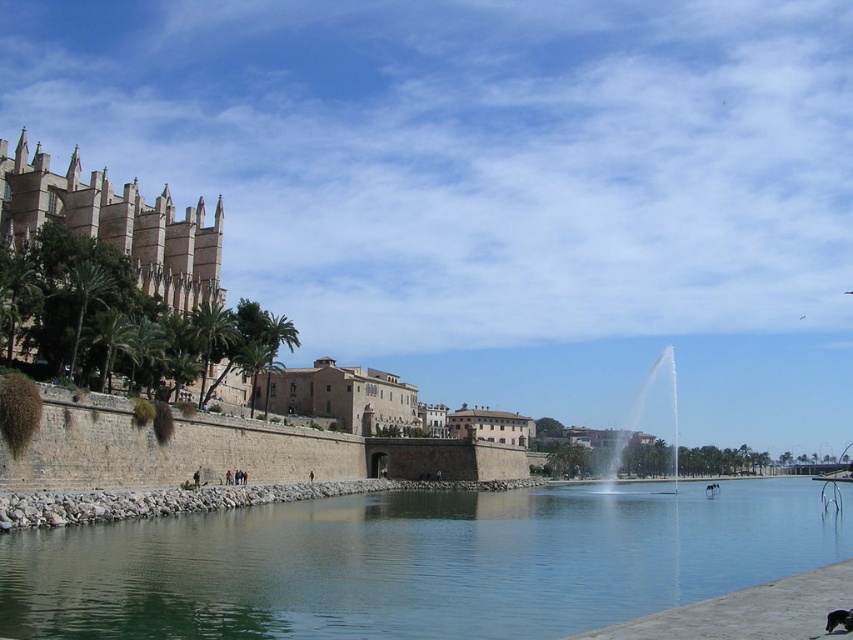
Find the location of a particular element. This screenshot has width=853, height=640. clear water at center is located at coordinates (415, 563).

Between point (572, 525) and point (416, 394), which one is positioned behind?

Point (416, 394)

Which is in front, point (579, 529) or point (289, 369)?

Point (579, 529) is more forward.

The width and height of the screenshot is (853, 640). Find the location of `clear water at center`. clear water at center is located at coordinates (415, 563).